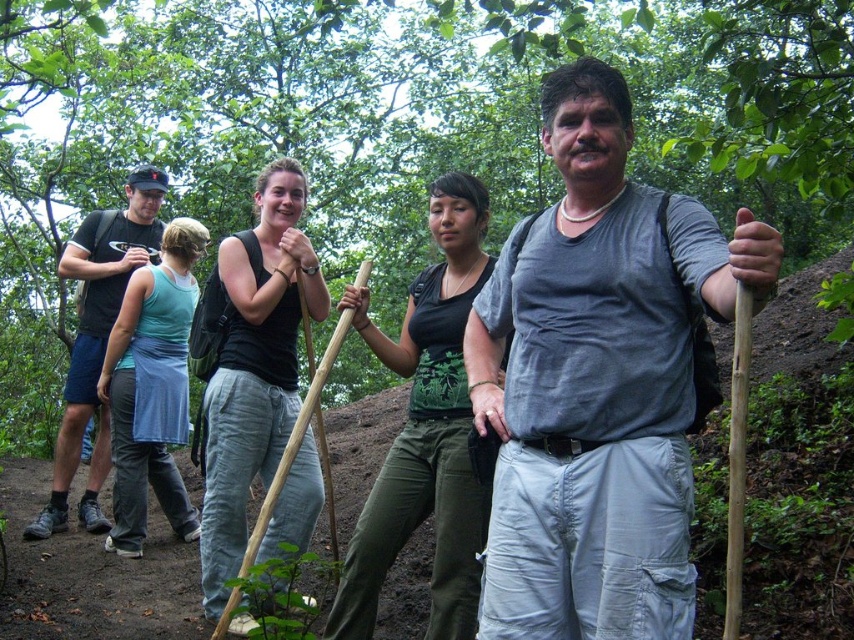
Question: Estimate the real-world distances between objects in this image. Which object is farther from the green matte shirt at center?

Choices:
 (A) black cotton tank top at center
 (B) gray matte tank top at center

Answer: (A)

Question: Does green leafy tree at upper center appear on the left side of teal fabric skirt at left?

Choices:
 (A) no
 (B) yes

Answer: (A)

Question: Is gray matte tank top at center above teal fabric skirt at left?

Choices:
 (A) yes
 (B) no

Answer: (A)

Question: Which point appears closest to the camera in this image?

Choices:
 (A) (177, 413)
 (B) (407, 358)
 (C) (241, 381)

Answer: (B)

Question: Based on their relative distances, which object is farther from the green matte shirt at center?

Choices:
 (A) green leafy tree at upper center
 (B) teal fabric skirt at left
 (C) gray matte tank top at center

Answer: (A)

Question: Can you confirm if green leafy tree at upper center is positioned above gray matte tank top at center?

Choices:
 (A) no
 (B) yes

Answer: (B)